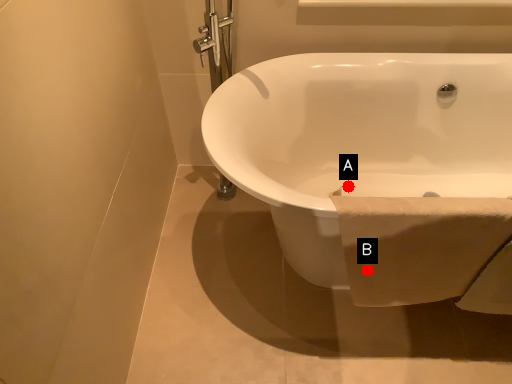
Question: Two points are circled on the image, labeled by A and B beside each circle. Which point is farther to the camera?

Choices:
 (A) A is further
 (B) B is further

Answer: (A)